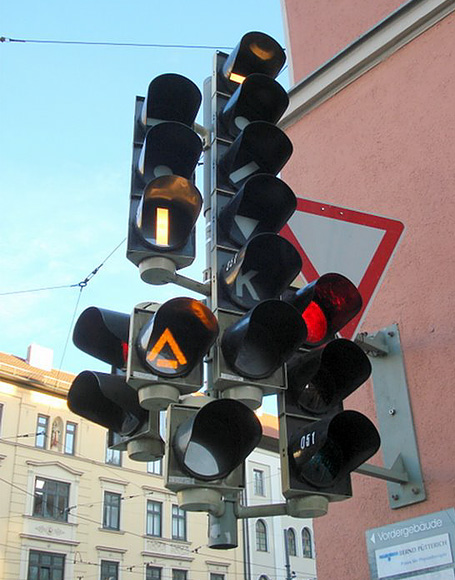
Image resolution: width=455 pixels, height=580 pixels. I want to click on wires, so click(x=44, y=286), click(x=67, y=328), click(x=105, y=258).